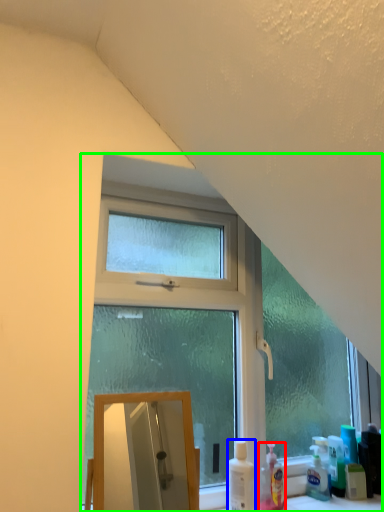
Question: Which object is positioned closest to cleaning product (highlighted by a red box)? Select from cleaning product (highlighted by a blue box) and window (highlighted by a green box).

Choices:
 (A) cleaning product
 (B) window

Answer: (A)